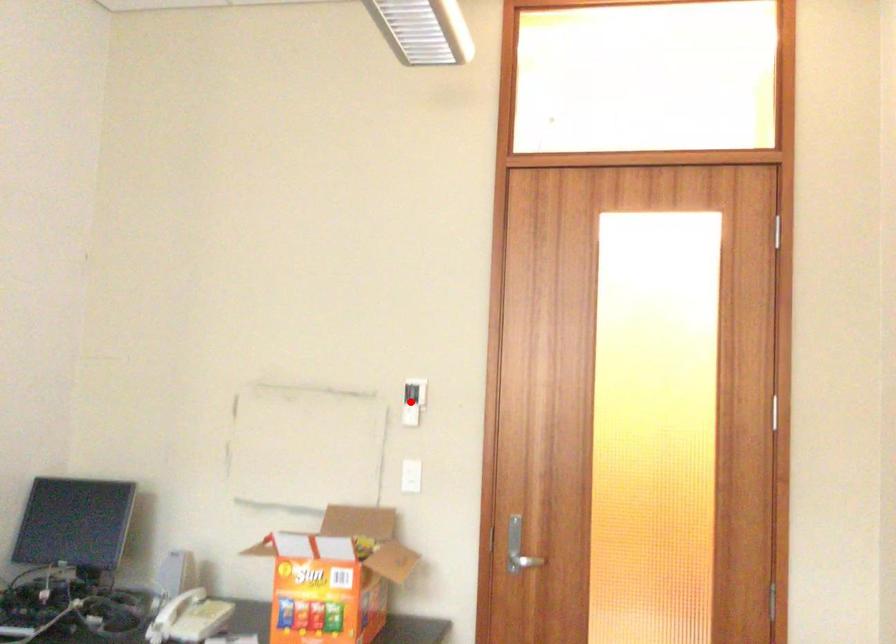
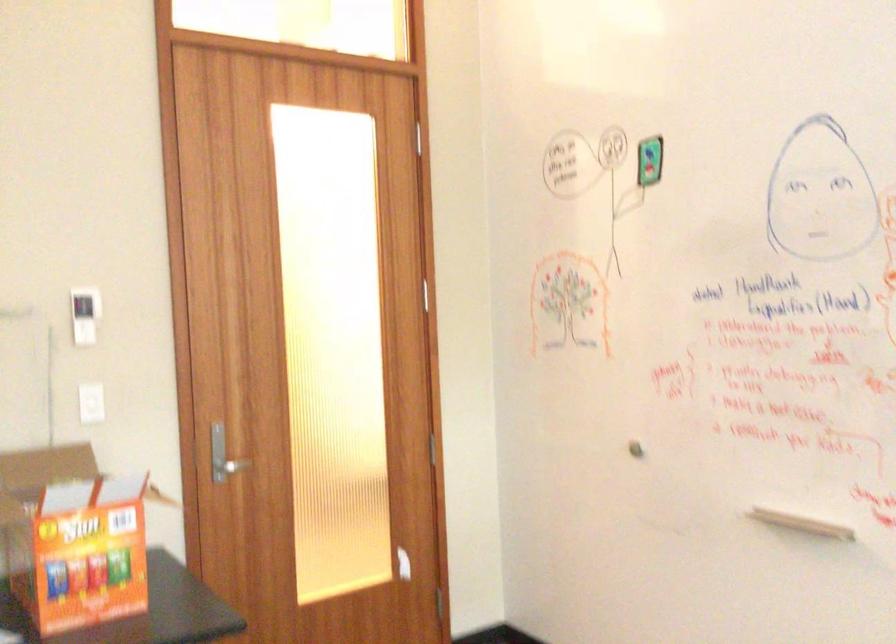
Question: I am providing you with two images of the same scene from different viewpoints. In image1, a red point is highlighted. Considering the same 3D point in image2, which of the following is correct?

Choices:
 (A) It is closer
 (B) It is farther

Answer: (A)